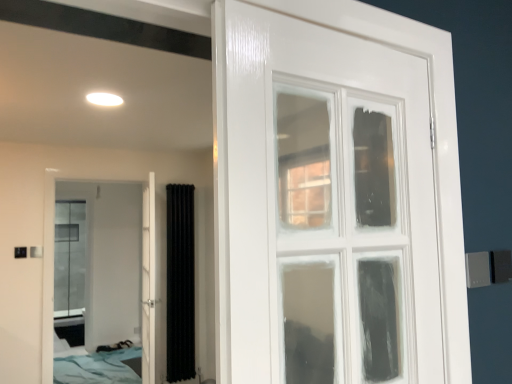
Question: Considering the positions of black textured curtain at center and blue fabric bed at lower left in the image, is black textured curtain at center bigger or smaller than blue fabric bed at lower left?

Choices:
 (A) big
 (B) small

Answer: (B)

Question: Looking at their shapes, would you say black textured curtain at center is wider or thinner than blue fabric bed at lower left?

Choices:
 (A) thin
 (B) wide

Answer: (A)

Question: Which object is positioned closest to the white glossy door at center, the first door positioned from the right?

Choices:
 (A) black textured curtain at center
 (B) white glossy door at left, the first door in the left-to-right sequence
 (C) blue fabric bed at lower left

Answer: (A)

Question: Considering the real-world distances, which object is closest to the black textured curtain at center?

Choices:
 (A) blue fabric bed at lower left
 (B) white glossy door at left, which is the 2th door from right to left
 (C) white glossy door at center, the 2th door from the left

Answer: (C)